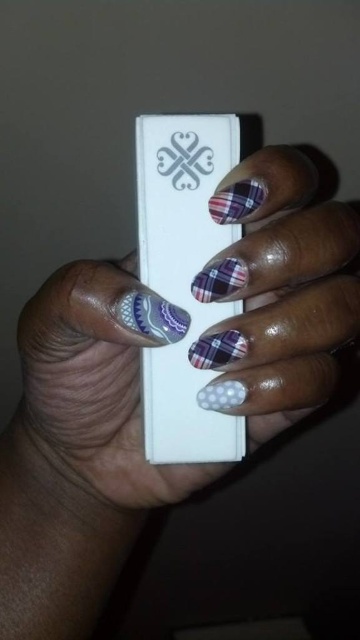
Question: Is white matte wii remote at center wider than matte silver heart at center?

Choices:
 (A) no
 (B) yes

Answer: (B)

Question: Can you confirm if white matte wii remote at center is positioned to the right of matte silver heart at center?

Choices:
 (A) yes
 (B) no

Answer: (A)

Question: Can you confirm if polka dot nail polish at center is positioned to the right of matte silver heart at center?

Choices:
 (A) no
 (B) yes

Answer: (B)

Question: Which is nearer to the matte silver heart at center?

Choices:
 (A) white matte wii remote at center
 (B) polka dot nail polish at center

Answer: (A)

Question: Among these objects, which one is nearest to the camera?

Choices:
 (A) white matte wii remote at center
 (B) polka dot nail polish at center
 (C) matte silver heart at center

Answer: (B)

Question: Which of the following is the farthest from the observer?

Choices:
 (A) white matte wii remote at center
 (B) matte silver heart at center
 (C) polka dot nail polish at center

Answer: (B)